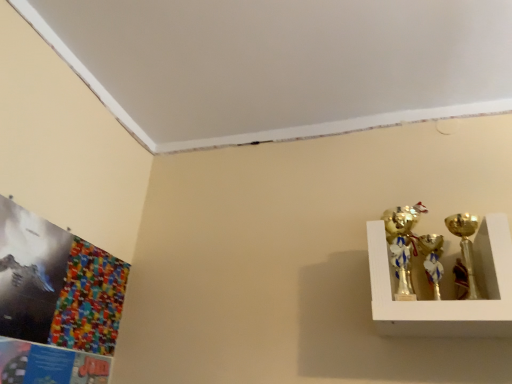
You are a GUI agent. You are given a task and a screenshot of the screen. Output one action in this format:
    pyautogui.click(x=<x>, y=<y>)
    Task: Click on the gold metallic trophy at upper right, the 2th candle holder in the right-to-left sequence
    The width and height of the screenshot is (512, 384).
    Given the screenshot: What is the action you would take?
    pyautogui.click(x=402, y=245)

Describe the element at coordinates (402, 245) in the screenshot. I see `gold metallic trophy at upper right, the 2th candle holder in the right-to-left sequence` at that location.

You are a GUI agent. You are given a task and a screenshot of the screen. Output one action in this format:
    pyautogui.click(x=<x>, y=<y>)
    Task: Click on the gold metallic candle holder at right, which ranks as the 1th candle holder in right-to-left order
    
    Given the screenshot: What is the action you would take?
    pyautogui.click(x=466, y=246)

This screenshot has width=512, height=384. What do you see at coordinates (466, 246) in the screenshot? I see `gold metallic candle holder at right, marked as the second candle holder in a left-to-right arrangement` at bounding box center [466, 246].

You are a GUI agent. You are given a task and a screenshot of the screen. Output one action in this format:
    pyautogui.click(x=<x>, y=<y>)
    Task: Click on the gold metallic trophy at upper right, the 2th candle holder in the right-to-left sequence
    
    Given the screenshot: What is the action you would take?
    (402, 245)

Which object is positioned more to the left, gold metallic candle holder at right, marked as the second candle holder in a left-to-right arrangement, or gold metallic trophy at upper right, the 2th candle holder in the right-to-left sequence?

From the viewer's perspective, gold metallic trophy at upper right, the 2th candle holder in the right-to-left sequence, appears more on the left side.

Between gold metallic candle holder at right, which ranks as the 1th candle holder in right-to-left order, and gold metallic trophy at upper right, the first candle holder positioned from the left, which one is positioned in front?

gold metallic candle holder at right, which ranks as the 1th candle holder in right-to-left order, is more forward.

Which point is more distant from viewer, (473,228) or (398,245)?

The point (398,245) is behind.

From the image's perspective, which one is positioned lower, gold metallic candle holder at right, marked as the second candle holder in a left-to-right arrangement, or gold metallic trophy at upper right, the first candle holder positioned from the left?

gold metallic candle holder at right, marked as the second candle holder in a left-to-right arrangement.

From a real-world perspective, is gold metallic candle holder at right, which ranks as the 1th candle holder in right-to-left order, above or below gold metallic trophy at upper right, the first candle holder positioned from the left?

In terms of real-world spatial position, gold metallic candle holder at right, which ranks as the 1th candle holder in right-to-left order, is below gold metallic trophy at upper right, the first candle holder positioned from the left.

Between gold metallic candle holder at right, marked as the second candle holder in a left-to-right arrangement, and gold metallic trophy at upper right, the 2th candle holder in the right-to-left sequence, which one has larger width?

Wider between the two is gold metallic candle holder at right, marked as the second candle holder in a left-to-right arrangement.

Which of these two, gold metallic candle holder at right, which ranks as the 1th candle holder in right-to-left order, or gold metallic trophy at upper right, the first candle holder positioned from the left, stands taller?

Standing taller between the two is gold metallic candle holder at right, which ranks as the 1th candle holder in right-to-left order.

Who is bigger, gold metallic candle holder at right, marked as the second candle holder in a left-to-right arrangement, or gold metallic trophy at upper right, the first candle holder positioned from the left?

gold metallic candle holder at right, marked as the second candle holder in a left-to-right arrangement.

Consider the image. Is gold metallic candle holder at right, marked as the second candle holder in a left-to-right arrangement, situated inside gold metallic trophy at upper right, the first candle holder positioned from the left, or outside?

gold metallic candle holder at right, marked as the second candle holder in a left-to-right arrangement, is outside gold metallic trophy at upper right, the first candle holder positioned from the left.

Are gold metallic candle holder at right, which ranks as the 1th candle holder in right-to-left order, and gold metallic trophy at upper right, the first candle holder positioned from the left, located far from each other?

No, there isn't a large distance between gold metallic candle holder at right, which ranks as the 1th candle holder in right-to-left order, and gold metallic trophy at upper right, the first candle holder positioned from the left.

Is gold metallic trophy at upper right, the first candle holder positioned from the left, at the back of gold metallic candle holder at right, which ranks as the 1th candle holder in right-to-left order?

gold metallic candle holder at right, which ranks as the 1th candle holder in right-to-left order, is not turned away from gold metallic trophy at upper right, the first candle holder positioned from the left.

Can you tell me how much gold metallic candle holder at right, marked as the second candle holder in a left-to-right arrangement, and gold metallic trophy at upper right, the first candle holder positioned from the left, differ in facing direction?

gold metallic candle holder at right, marked as the second candle holder in a left-to-right arrangement, and gold metallic trophy at upper right, the first candle holder positioned from the left, are facing 8.54e-05 degrees away from each other.

Measure the distance from gold metallic candle holder at right, marked as the second candle holder in a left-to-right arrangement, to gold metallic trophy at upper right, the first candle holder positioned from the left.

gold metallic candle holder at right, marked as the second candle holder in a left-to-right arrangement, is 6.53 inches from gold metallic trophy at upper right, the first candle holder positioned from the left.

Locate an element on the screen. candle holder in front of the gold metallic trophy at upper right, the first candle holder positioned from the left is located at coordinates (466, 246).

Considering the relative positions of gold metallic trophy at upper right, the 2th candle holder in the right-to-left sequence, and gold metallic candle holder at right, which ranks as the 1th candle holder in right-to-left order, in the image provided, is gold metallic trophy at upper right, the 2th candle holder in the right-to-left sequence, to the right of gold metallic candle holder at right, which ranks as the 1th candle holder in right-to-left order, from the viewer's perspective?

No, gold metallic trophy at upper right, the 2th candle holder in the right-to-left sequence, is not to the right of gold metallic candle holder at right, which ranks as the 1th candle holder in right-to-left order.

Is gold metallic trophy at upper right, the 2th candle holder in the right-to-left sequence, further to the viewer compared to gold metallic candle holder at right, which ranks as the 1th candle holder in right-to-left order?

Yes, it is.

Is point (387, 234) in front of point (472, 224)?

That is True.

From the image's perspective, which object appears higher, gold metallic trophy at upper right, the first candle holder positioned from the left, or gold metallic candle holder at right, which ranks as the 1th candle holder in right-to-left order?

gold metallic trophy at upper right, the first candle holder positioned from the left, appears higher in the image.

From a real-world perspective, is gold metallic trophy at upper right, the 2th candle holder in the right-to-left sequence, over gold metallic candle holder at right, which ranks as the 1th candle holder in right-to-left order?

Yes.

Considering the sizes of objects gold metallic trophy at upper right, the 2th candle holder in the right-to-left sequence, and gold metallic candle holder at right, which ranks as the 1th candle holder in right-to-left order, in the image provided, who is thinner, gold metallic trophy at upper right, the 2th candle holder in the right-to-left sequence, or gold metallic candle holder at right, which ranks as the 1th candle holder in right-to-left order,?

gold metallic trophy at upper right, the 2th candle holder in the right-to-left sequence, is thinner.

Considering the relative sizes of gold metallic trophy at upper right, the 2th candle holder in the right-to-left sequence, and gold metallic candle holder at right, which ranks as the 1th candle holder in right-to-left order, in the image provided, is gold metallic trophy at upper right, the 2th candle holder in the right-to-left sequence, taller than gold metallic candle holder at right, which ranks as the 1th candle holder in right-to-left order,?

Incorrect, the height of gold metallic trophy at upper right, the 2th candle holder in the right-to-left sequence, is not larger of that of gold metallic candle holder at right, which ranks as the 1th candle holder in right-to-left order.

Which of these two, gold metallic trophy at upper right, the first candle holder positioned from the left, or gold metallic candle holder at right, which ranks as the 1th candle holder in right-to-left order, is bigger?

With larger size is gold metallic candle holder at right, which ranks as the 1th candle holder in right-to-left order.

Is gold metallic trophy at upper right, the 2th candle holder in the right-to-left sequence, positioned beyond the bounds of gold metallic candle holder at right, marked as the second candle holder in a left-to-right arrangement?

Yes, gold metallic trophy at upper right, the 2th candle holder in the right-to-left sequence, is not within gold metallic candle holder at right, marked as the second candle holder in a left-to-right arrangement.

Is gold metallic trophy at upper right, the first candle holder positioned from the left, in contact with gold metallic candle holder at right, marked as the second candle holder in a left-to-right arrangement?

No, gold metallic trophy at upper right, the first candle holder positioned from the left, is not touching gold metallic candle holder at right, marked as the second candle holder in a left-to-right arrangement.

Is gold metallic trophy at upper right, the first candle holder positioned from the left, oriented towards gold metallic candle holder at right, which ranks as the 1th candle holder in right-to-left order?

No, gold metallic trophy at upper right, the first candle holder positioned from the left, is not oriented towards gold metallic candle holder at right, which ranks as the 1th candle holder in right-to-left order.

Identify the location of candle holder located above the gold metallic candle holder at right, marked as the second candle holder in a left-to-right arrangement (from the image's perspective). The height and width of the screenshot is (384, 512). (402, 245).

Locate an element on the screen. candle holder above the gold metallic candle holder at right, marked as the second candle holder in a left-to-right arrangement (from the image's perspective) is located at coordinates (402, 245).

Find the location of a particular element. This screenshot has height=384, width=512. candle holder below the gold metallic trophy at upper right, the 2th candle holder in the right-to-left sequence (from a real-world perspective) is located at coordinates (466, 246).